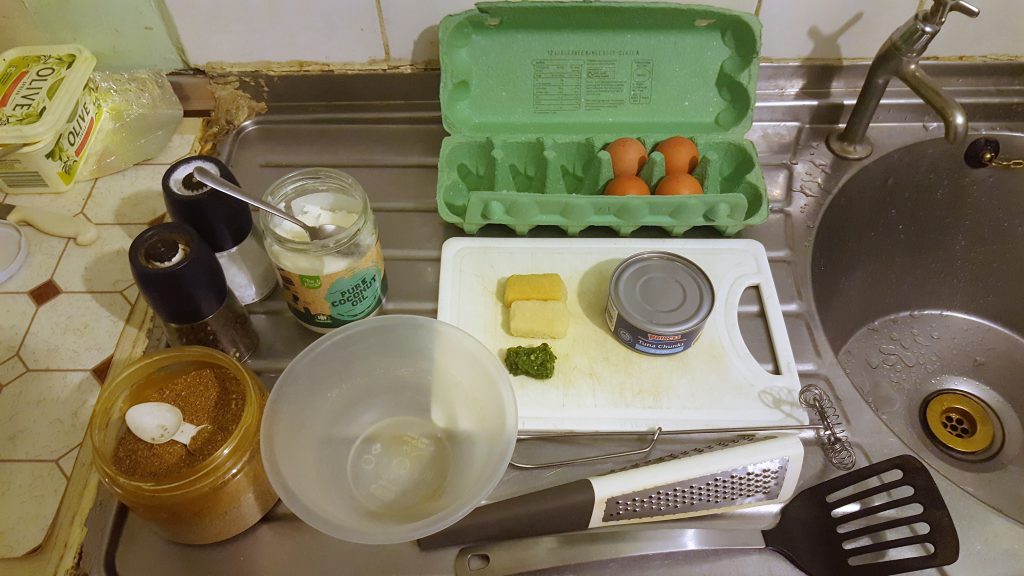
Where is `salt and pepper grinders`? Image resolution: width=1024 pixels, height=576 pixels. salt and pepper grinders is located at coordinates (245, 256), (224, 322), (200, 276), (200, 215).